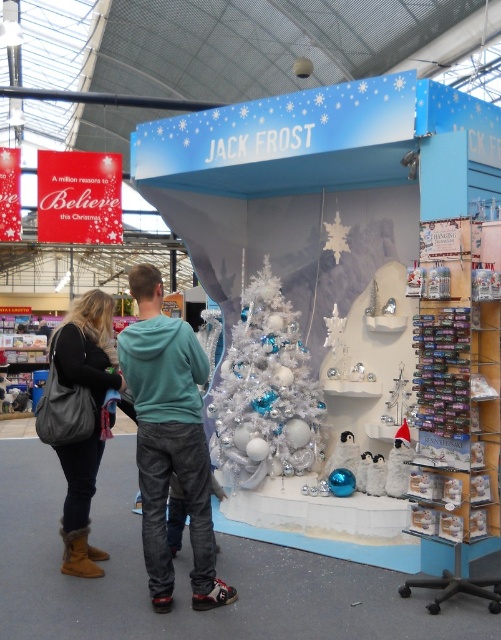
You are a customer browsing the Jack Frost festive display. You see a leather jacket at center and leather boots at lower left. Which item takes up more space in the display?

The leather jacket at center is larger in size than the leather boots at lower left, so it takes up more space in the display.

You are a store employee who needs to place a new sign that is 1.2 meters wide between the white glossy christmas tree at center and the leather boots at lower left. Based on the display layout, will the sign fit in the space between them?

The white glossy christmas tree at center is wider than the leather boots at lower left. Since the sign is 1.2 meters wide, it depends on the actual width of the tree and boots. However, the description only states the tree is wider than the boots but doesn

Looking at this image, you are a shopper looking to purchase a leather jacket at center and leather boots at lower left. The store has a narrow doorway that is 1.2 meters wide. If you want to carry both items while passing through the doorway, will they fit side by side?

The leather jacket at center might be wider than leather boots at lower left, so it is uncertain if both items can fit side by side through the 1.2 meters wide doorway.